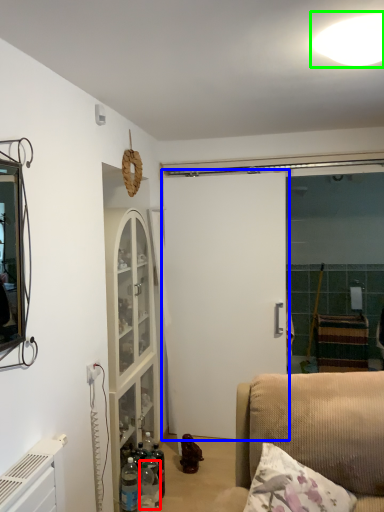
Question: Which is farther away from bottle (highlighted by a red box)? door (highlighted by a blue box) or light (highlighted by a green box)?

Choices:
 (A) door
 (B) light

Answer: (B)